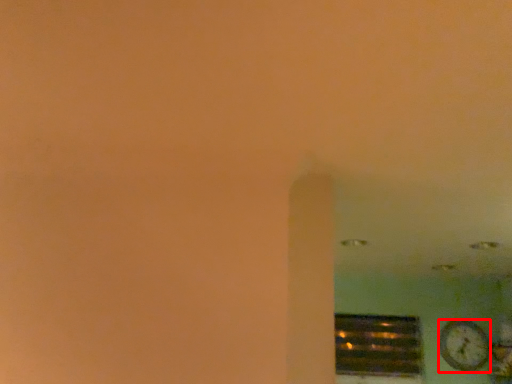
Question: Where is clock (annotated by the red box) located in relation to window in the image?

Choices:
 (A) left
 (B) right

Answer: (B)